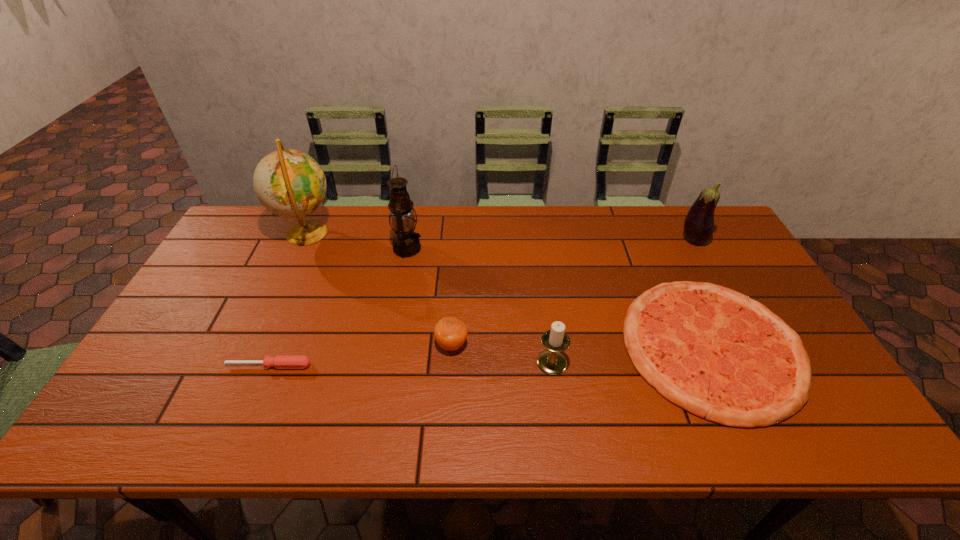
In order to click on globe in this screenshot , I will do `click(289, 183)`.

Where is `oil lamp`? oil lamp is located at coordinates (406, 243).

The height and width of the screenshot is (540, 960). Identify the location of the fifth shortest object. (699, 223).

This screenshot has height=540, width=960. I want to click on candle holder, so click(551, 361).

The height and width of the screenshot is (540, 960). I want to click on the fourth tallest object, so click(x=551, y=361).

The height and width of the screenshot is (540, 960). Identify the location of the fourth object from left to right. (450, 333).

Where is `orange`? This screenshot has width=960, height=540. orange is located at coordinates (450, 333).

This screenshot has height=540, width=960. I want to click on pizza, so click(x=718, y=354).

Where is `screwdriver`? Image resolution: width=960 pixels, height=540 pixels. screwdriver is located at coordinates (280, 361).

Where is `blank space located 0.260m on the right of the globe`? blank space located 0.260m on the right of the globe is located at coordinates (415, 232).